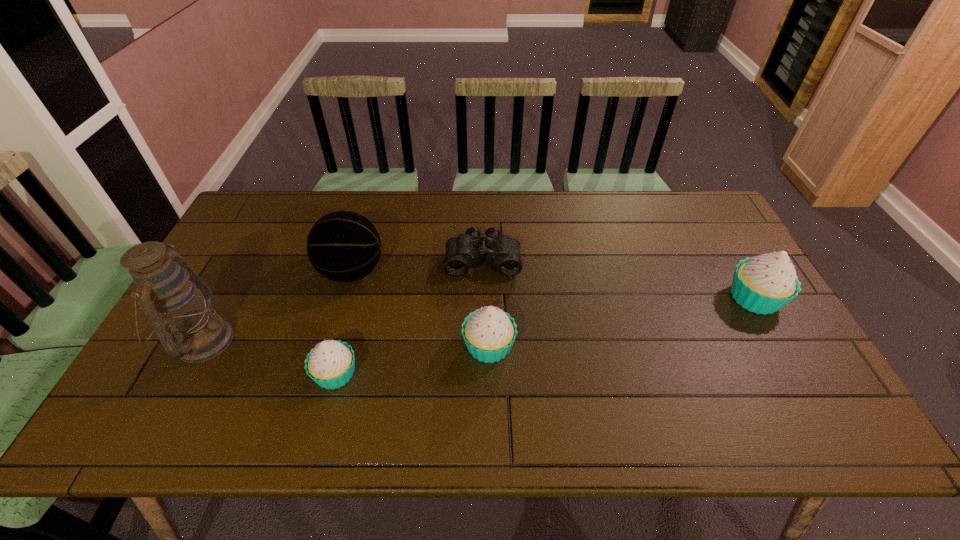
At what (x,y) coordinates should I click in order to perform the action: click on vacant area at the far edge of the desktop. Please return your answer as a coordinate pair (x, y). Looking at the image, I should click on (591, 219).

Locate an element on the screen. This screenshot has width=960, height=540. vacant region at the near edge of the desktop is located at coordinates (495, 394).

At what (x,y) coordinates should I click in order to perform the action: click on vacant space at the left edge. Please return your answer as a coordinate pair (x, y). Looking at the image, I should click on (236, 327).

In the image, there is a desktop. Where is `blank space at the right edge`? The height and width of the screenshot is (540, 960). blank space at the right edge is located at coordinates (707, 290).

The height and width of the screenshot is (540, 960). Find the location of `vacant space at the far left corner of the desktop`. vacant space at the far left corner of the desktop is located at coordinates (263, 228).

Identify the location of vacant space at the far right corner of the desktop. This screenshot has width=960, height=540. (689, 232).

Identify the location of vacant space in between the basketball and the leftmost object. The height and width of the screenshot is (540, 960). (277, 306).

This screenshot has height=540, width=960. Identify the location of free space that is in between the second shortest cupcake and the basketball. (420, 309).

Find the location of a particular element. The height and width of the screenshot is (540, 960). free space between the rightmost cupcake and the basketball is located at coordinates (553, 285).

The width and height of the screenshot is (960, 540). I want to click on unoccupied position between the basketball and the fifth tallest object, so click(x=344, y=322).